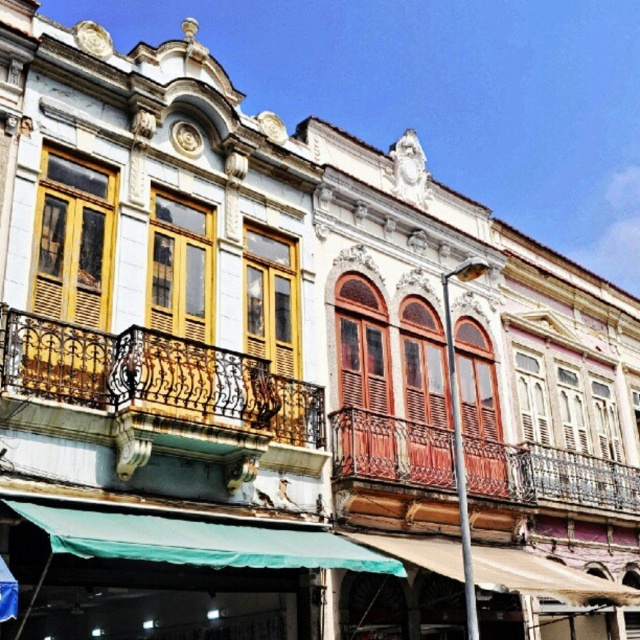
You are standing on the ground floor of the building and looking up at the balconies. Which balcony, the rusty metal balcony at left or the rustic wood balcony at center, is positioned higher?

The rusty metal balcony at left is located above the rustic wood balcony at center, so it is positioned higher.

Consider the image. You are a painter hired to restore the balconies on this historic building. You have a ladder that is 40 feet long. You need to move it from the rusty metal balcony at left to the rustic wood balcony at center. Can you safely carry the ladder horizontally between them without it touching the ground?

The distance between the rusty metal balcony at left and the rustic wood balcony at center is 42.91 feet. Since the ladder is only 40 feet long, it would not be long enough to span the gap safely. You would need a longer ladder to avoid touching the ground.

Looking at this image, you are an architect inspecting the building and need to determine which balcony can accommodate more people for a small gathering. Based on the image, which balcony between the rusty metal balcony at left and the rustic wood balcony at center would be more suitable?

The rustic wood balcony at center is larger in size than the rusty metal balcony at left, making it more suitable for accommodating more people for a small gathering.